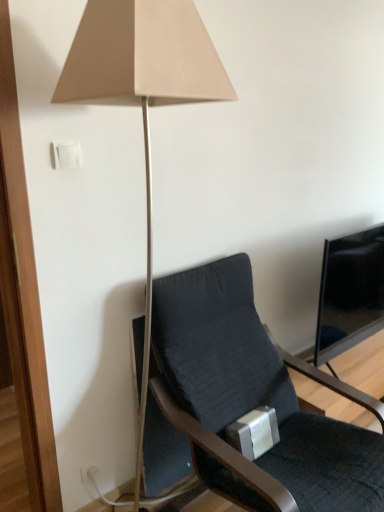
Question: Considering the relative positions of matte beige lamp at upper center and dark gray fabric chair at center in the image provided, is matte beige lamp at upper center to the left of dark gray fabric chair at center from the viewer's perspective?

Choices:
 (A) no
 (B) yes

Answer: (B)

Question: Is dark gray fabric chair at center completely or partially inside matte beige lamp at upper center?

Choices:
 (A) yes
 (B) no

Answer: (B)

Question: Is matte beige lamp at upper center facing away from dark gray fabric chair at center?

Choices:
 (A) no
 (B) yes

Answer: (A)

Question: From the image's perspective, is matte beige lamp at upper center above dark gray fabric chair at center?

Choices:
 (A) yes
 (B) no

Answer: (A)

Question: Is matte beige lamp at upper center at the right side of dark gray fabric chair at center?

Choices:
 (A) yes
 (B) no

Answer: (B)

Question: Can you confirm if matte beige lamp at upper center is wider than dark gray fabric chair at center?

Choices:
 (A) no
 (B) yes

Answer: (A)

Question: Does black glossy screen at right have a greater width compared to white plastic light switch at upper left?

Choices:
 (A) yes
 (B) no

Answer: (A)

Question: Is white plastic light switch at upper left located within black glossy screen at right?

Choices:
 (A) no
 (B) yes

Answer: (A)

Question: Is black glossy screen at right to the left of white plastic light switch at upper left from the viewer's perspective?

Choices:
 (A) yes
 (B) no

Answer: (B)

Question: Is black glossy screen at right positioned before white plastic light switch at upper left?

Choices:
 (A) yes
 (B) no

Answer: (B)

Question: From a real-world perspective, is black glossy screen at right under white plastic light switch at upper left?

Choices:
 (A) no
 (B) yes

Answer: (B)

Question: Is black glossy screen at right next to white plastic light switch at upper left?

Choices:
 (A) no
 (B) yes

Answer: (A)

Question: Is dark gray fabric chair at center outside of white plastic light switch at upper left?

Choices:
 (A) yes
 (B) no

Answer: (A)